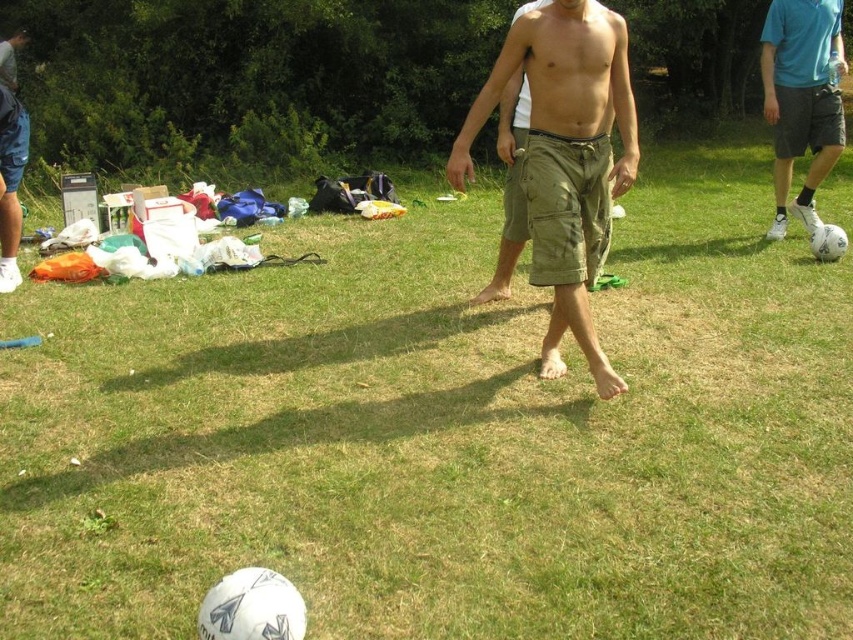
Who is positioned more to the right, khaki cotton shorts at center or brushed metal water at bottle left?

khaki cotton shorts at center

I want to click on khaki cotton shorts at center, so click(x=566, y=157).

Locate an element on the screen. khaki cotton shorts at center is located at coordinates (566, 157).

Does white matte soccer ball at right have a lesser width compared to brushed metal water at bottle left?

No, white matte soccer ball at right is not thinner than brushed metal water at bottle left.

Is white matte soccer ball at right shorter than brushed metal water at bottle left?

In fact, white matte soccer ball at right may be taller than brushed metal water at bottle left.

Who is more forward, (790,16) or (10,100)?

Point (10,100)

Find the location of a particular element. Image resolution: width=853 pixels, height=640 pixels. white matte soccer ball at right is located at coordinates (801, 99).

Does khaki cotton shorts at center have a greater width compared to white matte soccer ball at right?

Correct, the width of khaki cotton shorts at center exceeds that of white matte soccer ball at right.

Based on the photo, does khaki cotton shorts at center appear on the right side of white matte soccer ball at right?

Incorrect, khaki cotton shorts at center is not on the right side of white matte soccer ball at right.

Where is `khaki cotton shorts at center`? The width and height of the screenshot is (853, 640). khaki cotton shorts at center is located at coordinates (566, 157).

You are a GUI agent. You are given a task and a screenshot of the screen. Output one action in this format:
    pyautogui.click(x=<x>, y=<y>)
    Task: Click on the khaki cotton shorts at center
    
    Given the screenshot: What is the action you would take?
    pyautogui.click(x=566, y=157)